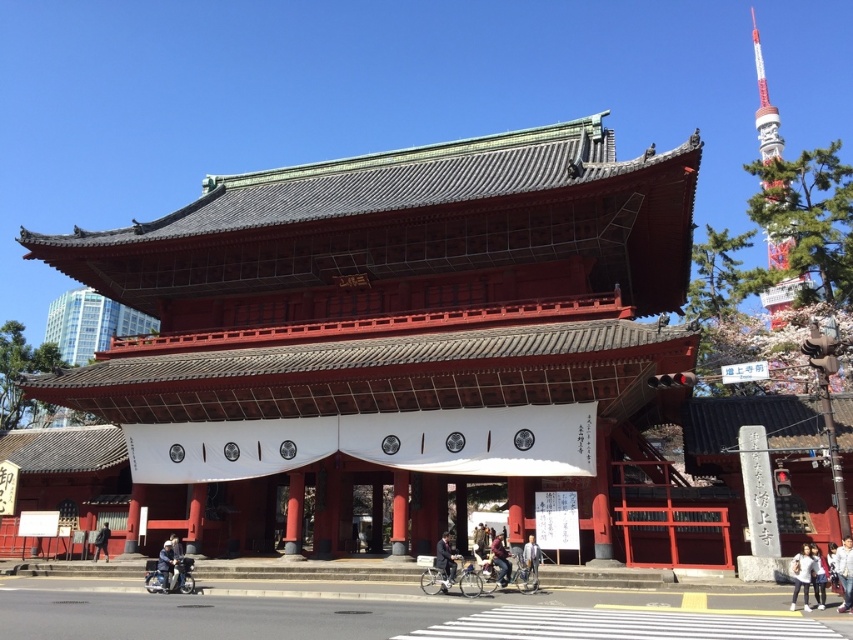
Looking at this image, can you confirm if metallic red tower at upper right is positioned below white cotton shirt at center?

No.

Find the location of a particular element. The width and height of the screenshot is (853, 640). metallic red tower at upper right is located at coordinates (764, 106).

In order to click on metallic red tower at upper right in this screenshot , I will do `click(764, 106)`.

Where is `metallic red tower at upper right`? The height and width of the screenshot is (640, 853). metallic red tower at upper right is located at coordinates (764, 106).

Which is above, metallic silver motorcycle at lower center or dark blue fabric jacket at lower center?

dark blue fabric jacket at lower center is higher up.

Which of these two, metallic silver motorcycle at lower center or dark blue fabric jacket at lower center, stands taller?

Standing taller between the two is metallic silver motorcycle at lower center.

Is point (439, 566) behind point (167, 544)?

No, (439, 566) is closer to viewer.

Where is `metallic silver motorcycle at lower center`? Image resolution: width=853 pixels, height=640 pixels. metallic silver motorcycle at lower center is located at coordinates (450, 579).

Can you confirm if dark blue suit at center is positioned to the left of dark brown leather jacket at center?

Yes, dark blue suit at center is to the left of dark brown leather jacket at center.

Is dark blue suit at center above dark brown leather jacket at center?

Yes, dark blue suit at center is above dark brown leather jacket at center.

Between point (444, 576) and point (474, 547), which one is positioned in front?

Point (444, 576) is more forward.

The height and width of the screenshot is (640, 853). I want to click on dark blue suit at center, so click(x=445, y=561).